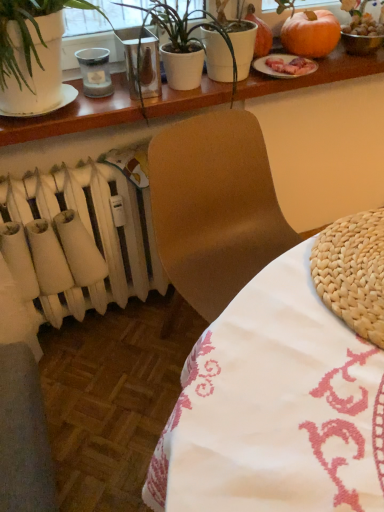
In order to click on blank space situated above white woven placemat at lower left, which ranks as the 1th table in bottom-to-top order (from a real-world perspective) in this screenshot , I will do `click(299, 306)`.